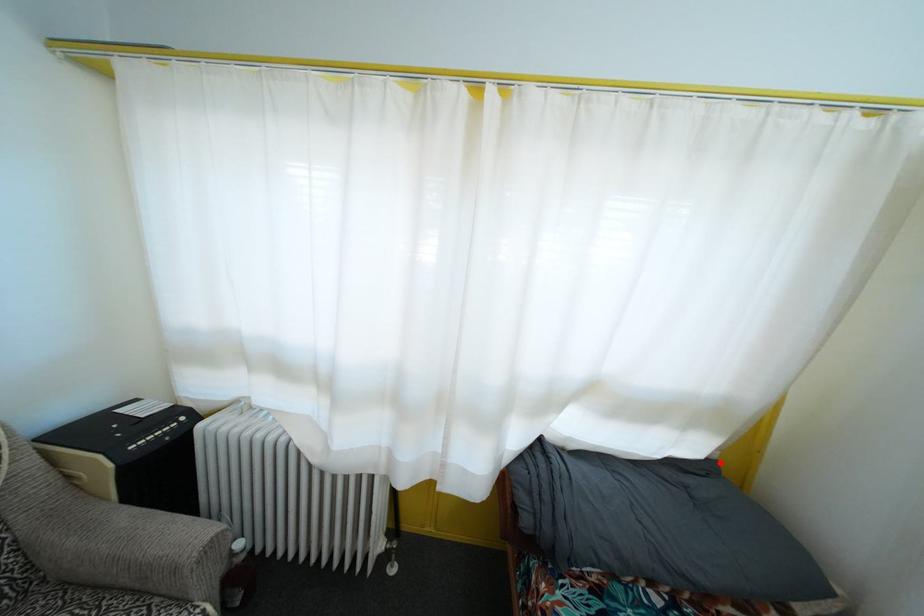
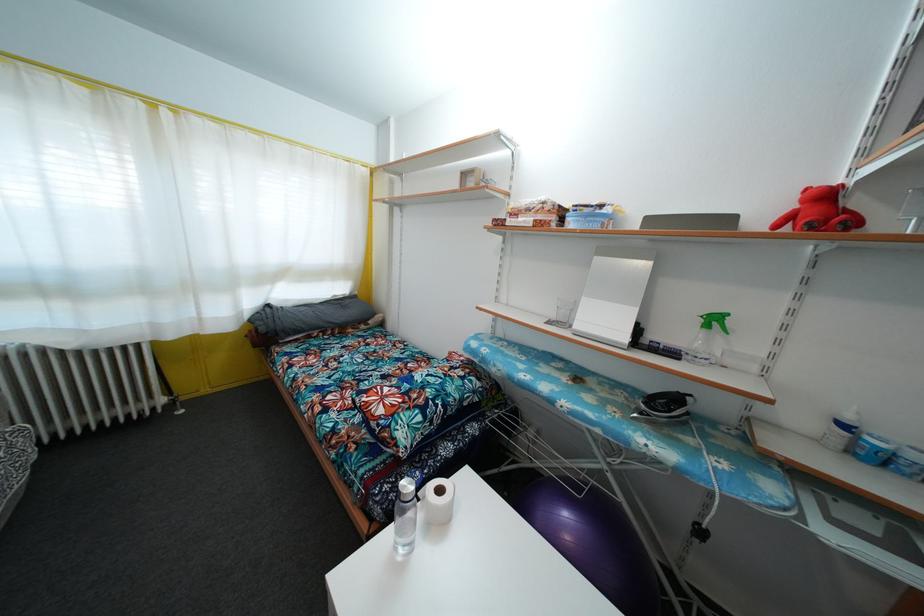
Locate, in the second image, the point that corresponds to the highlighted location in the first image.

(359, 300)